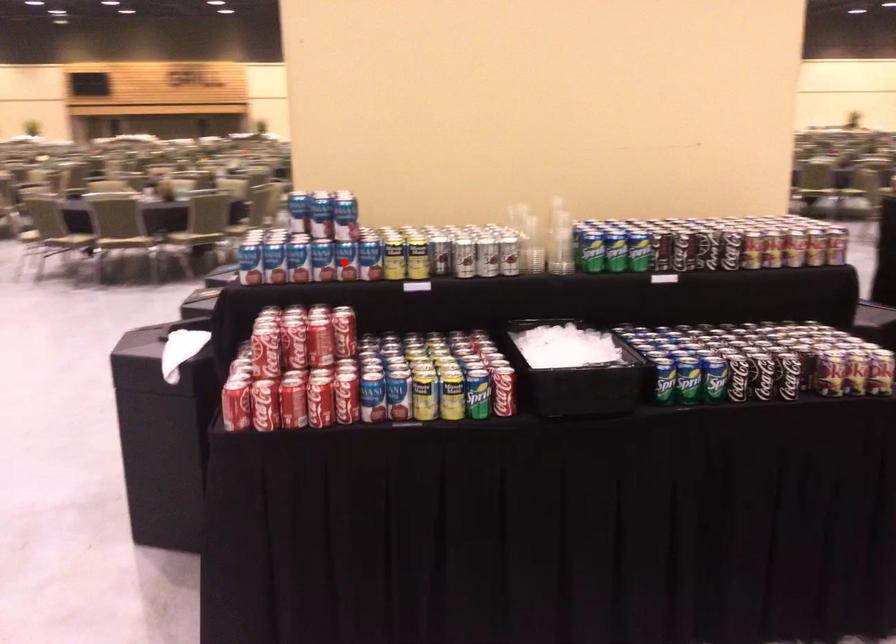
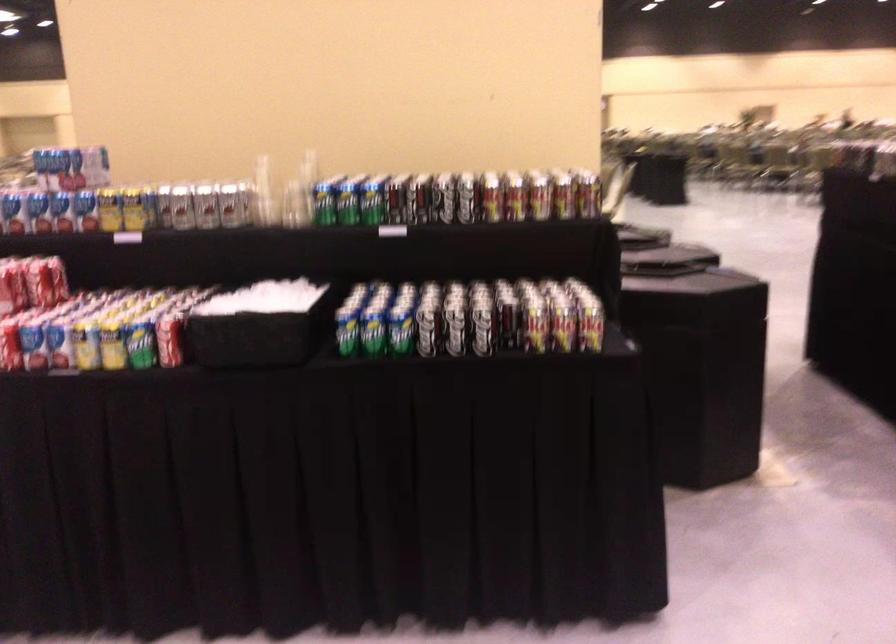
Where in the second image is the point corresponding to the highlighted location from the first image?

(61, 211)